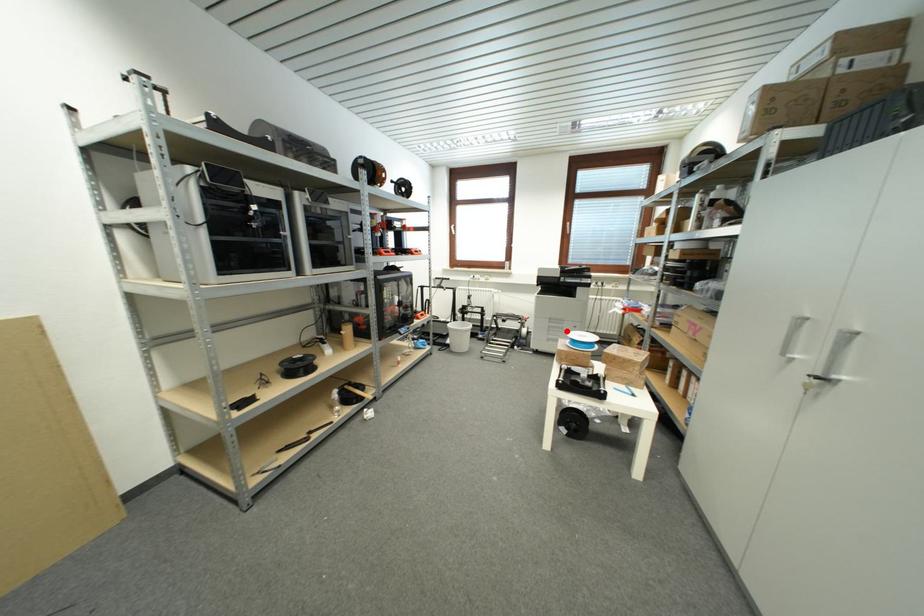
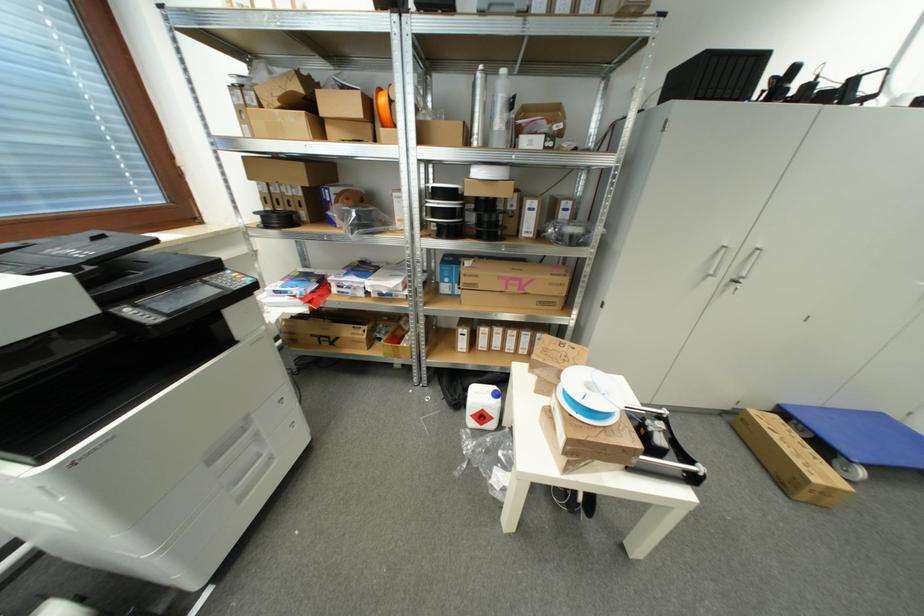
Question: I am providing you with two images of the same scene from different viewpoints. A red point is marked on the first image. Can you still see the location of the red point in image 2?

Choices:
 (A) Yes
 (B) No

Answer: (A)